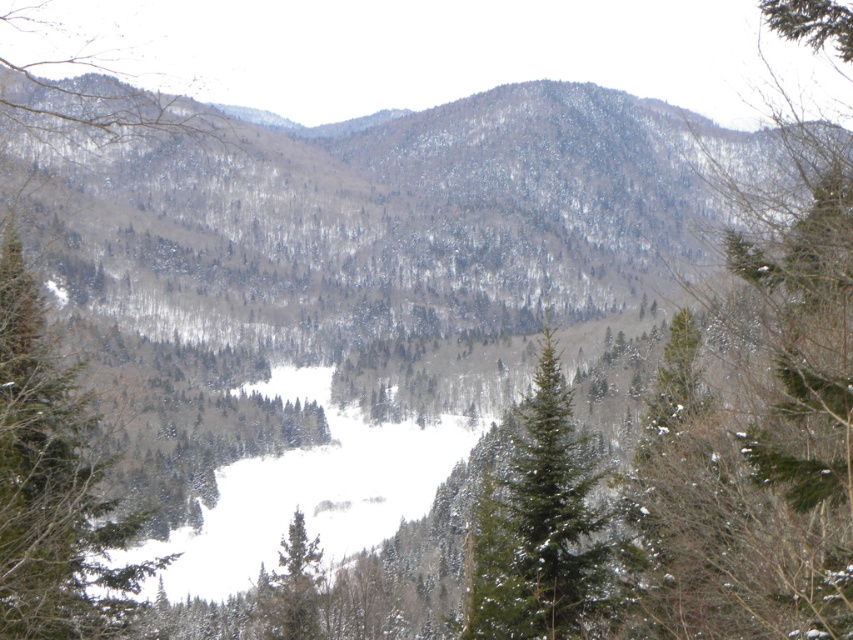
Is green textured pine at center further to the viewer compared to green matte tree at lower center?

No, it is in front of green matte tree at lower center.

Is green textured pine at center positioned in front of green matte tree at lower center?

That is True.

Does point (647, 445) come farther from viewer compared to point (289, 524)?

No.

Locate an element on the screen. green textured pine at center is located at coordinates (756, 422).

Who is positioned more to the left, green textured pine at center or green matte tree at center-left?

Positioned to the left is green matte tree at center-left.

From the picture: Who is more forward, (824, 360) or (85, 628)?

Positioned in front is point (824, 360).

Locate an element on the screen. This screenshot has width=853, height=640. green textured pine at center is located at coordinates (756, 422).

What do you see at coordinates (538, 524) in the screenshot? The width and height of the screenshot is (853, 640). I see `green matte tree at center` at bounding box center [538, 524].

Locate an element on the screen. The width and height of the screenshot is (853, 640). green matte tree at center is located at coordinates (538, 524).

Find the location of a particular element. green matte tree at center is located at coordinates (538, 524).